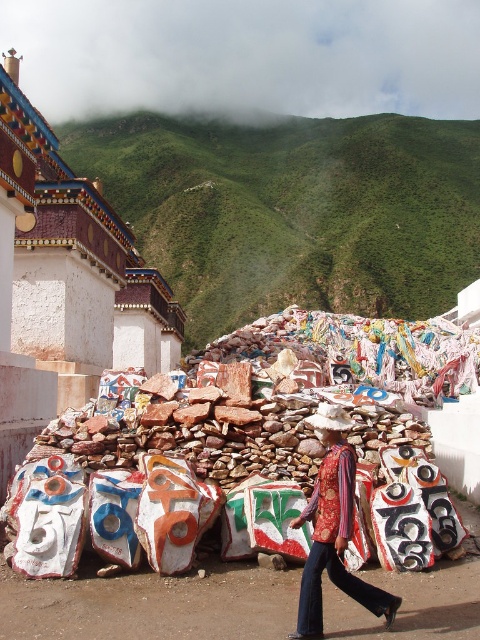
Question: Is white painted stone at upper left smaller than patterned fabric shirt at center?

Choices:
 (A) yes
 (B) no

Answer: (B)

Question: Is the position of green grassy hillside at upper center more distant than that of patterned fabric shirt at center?

Choices:
 (A) no
 (B) yes

Answer: (B)

Question: Which of the following is the farthest from the observer?

Choices:
 (A) patterned fabric shirt at center
 (B) green grassy hillside at upper center

Answer: (B)

Question: Which point is farther from the camera taking this photo?

Choices:
 (A) (471, 136)
 (B) (21, 134)
 (C) (330, 458)

Answer: (A)

Question: Which object is positioned farthest from the white painted stone at upper left?

Choices:
 (A) green grassy hillside at upper center
 (B) patterned fabric shirt at center

Answer: (A)

Question: Can you confirm if green grassy hillside at upper center is positioned to the right of patterned fabric shirt at center?

Choices:
 (A) yes
 (B) no

Answer: (A)